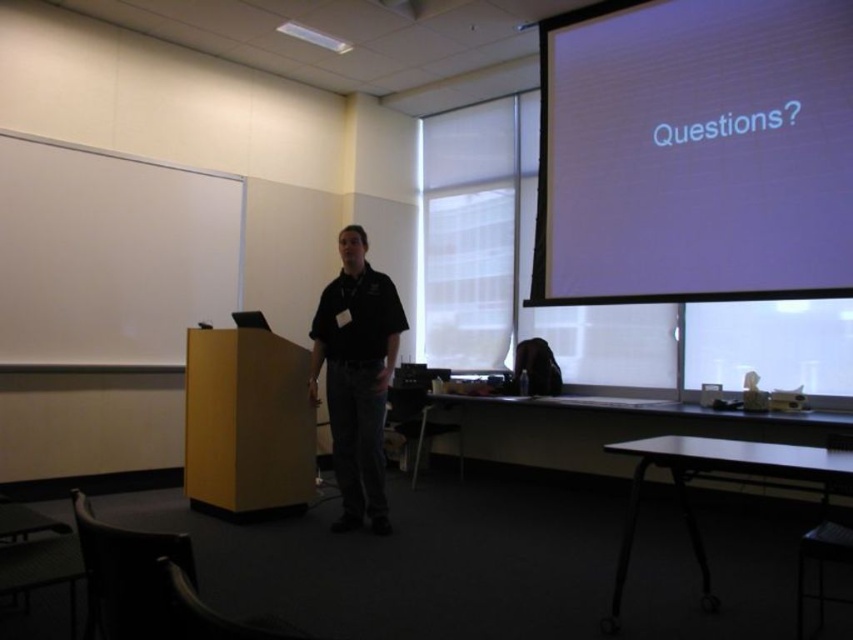
Question: Which point is farther to the camera?

Choices:
 (A) yellow wood podium at left
 (B) black matte shirt at center

Answer: (A)

Question: Can you confirm if white matte projection screen at upper right is positioned to the right of black matte shirt at center?

Choices:
 (A) no
 (B) yes

Answer: (B)

Question: Is yellow wood podium at left in front of black matte shirt at center?

Choices:
 (A) yes
 (B) no

Answer: (B)

Question: Does white matte projection screen at upper right have a greater width compared to yellow wood podium at left?

Choices:
 (A) no
 (B) yes

Answer: (B)

Question: Among these points, which one is nearest to the camera?

Choices:
 (A) (701, 131)
 (B) (350, 460)

Answer: (B)

Question: Which object is closer to the camera taking this photo?

Choices:
 (A) yellow wood podium at left
 (B) black matte shirt at center

Answer: (B)